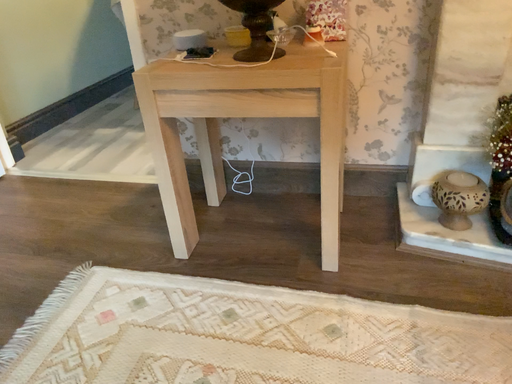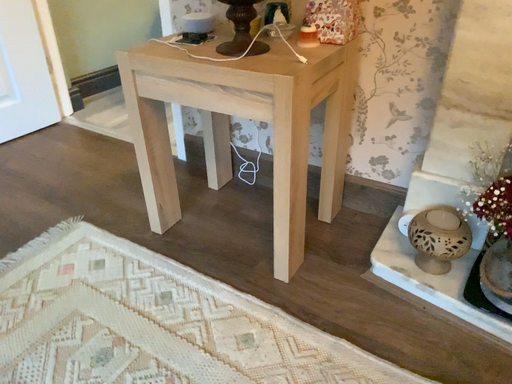
Question: How did the camera likely rotate when shooting the video?

Choices:
 (A) rotated left
 (B) rotated right

Answer: (A)